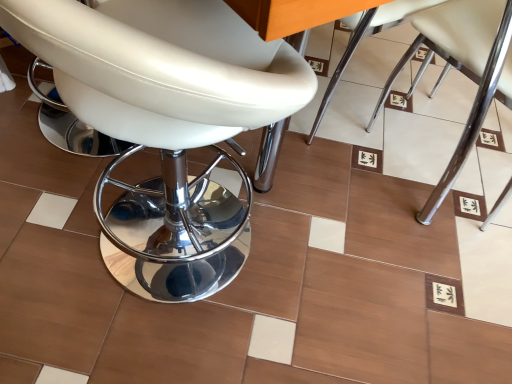
Question: In the image, is white leather chair at center, acting as the 2th chair starting from the right, positioned in front of or behind white leather stool at left, which appears as the third chair when viewed from the right?

Choices:
 (A) behind
 (B) front

Answer: (A)

Question: From a real-world perspective, is white leather chair at center, which ranks as the second chair in left-to-right order, positioned above or below white leather stool at left, which appears as the first chair when viewed from the left?

Choices:
 (A) above
 (B) below

Answer: (B)

Question: Estimate the real-world distances between objects in this image. Which object is farther from the white leather stool at left, which appears as the first chair when viewed from the left?

Choices:
 (A) white leather chair at center, acting as the 2th chair starting from the right
 (B) white leather chair at center, the 1th chair viewed from the right

Answer: (B)

Question: Which of these objects is positioned farthest from the white leather chair at center, acting as the 2th chair starting from the right?

Choices:
 (A) white leather stool at left, which appears as the first chair when viewed from the left
 (B) white leather chair at center, the 1th chair viewed from the right

Answer: (A)